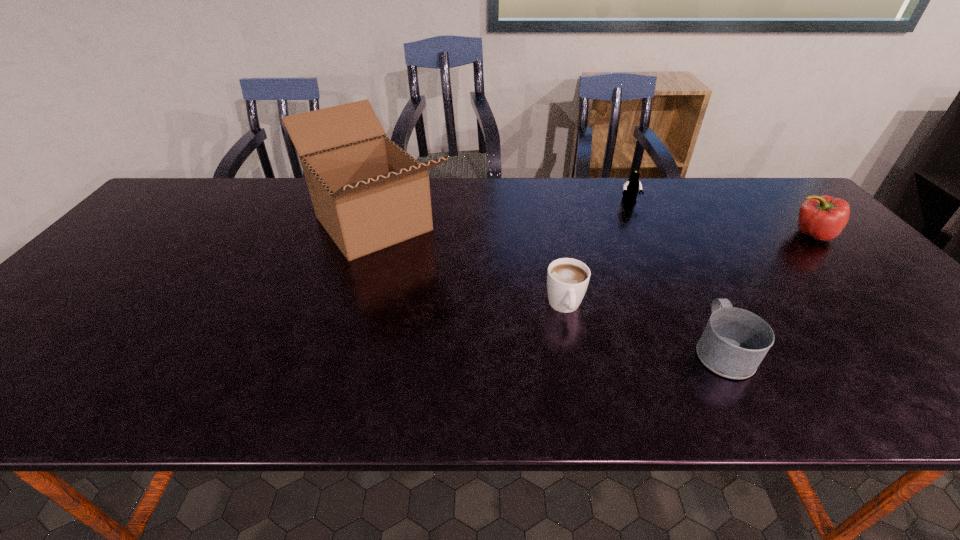
In the image, there is a desktop. Identify the location of vacant area at the far left corner. (224, 180).

At what (x,y) coordinates should I click in order to perform the action: click on unoccupied position between the tallest object and the fourth object from right to left. Please return your answer as a coordinate pair (x, y). This screenshot has height=540, width=960. Looking at the image, I should click on (469, 265).

Where is `vacant area between the mug and the fourth object from right to left`? vacant area between the mug and the fourth object from right to left is located at coordinates (643, 328).

Where is `free space between the Lego and the second object from left to right`? free space between the Lego and the second object from left to right is located at coordinates (597, 254).

Where is `free space between the cappuccino and the Lego`? Image resolution: width=960 pixels, height=540 pixels. free space between the cappuccino and the Lego is located at coordinates (597, 254).

Identify the location of unoccupied area between the fourth object from right to left and the Lego. The image size is (960, 540). 597,254.

You are a GUI agent. You are given a task and a screenshot of the screen. Output one action in this format:
    pyautogui.click(x=<x>, y=<y>)
    Task: Click on the vacant region between the tallest object and the Lego
    
    Given the screenshot: What is the action you would take?
    pyautogui.click(x=501, y=213)

I want to click on free spot between the box and the Lego, so click(501, 213).

I want to click on vacant area that lies between the Lego and the rightmost object, so tap(720, 218).

Identify which object is located as the nearest to the rightmost object. Please provide its 2D coordinates. Your answer should be formatted as a tuple, i.e. [(x, y)], where the tuple contains the x and y coordinates of a point satisfying the conditions above.

[(631, 187)]